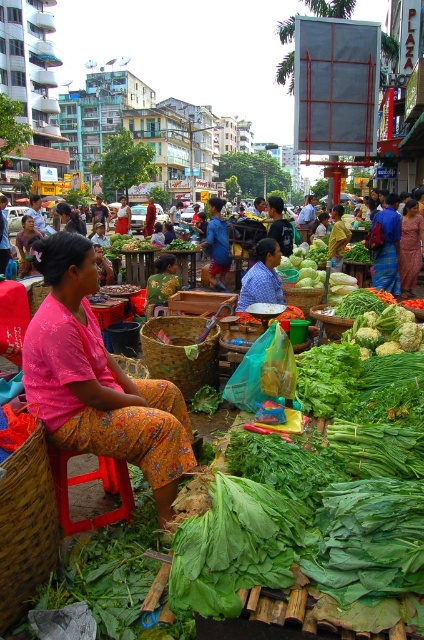
You are a tailor observing the clothing items in the market. You need to determine which clothing item has a greater width between the pink fabric skirt at center and the green textured blouse at center. Which one is wider?

The pink fabric skirt at center is wider than the green textured blouse at center according to the description provided.

From the picture: You are standing in the market and want to reach both the point at coordinates (21, 497) and the point at coordinates (156, 582). Which point is closer to you?

Point at coordinates (21, 497) is closer to you because it is further to the viewer than point at coordinates (156, 582).